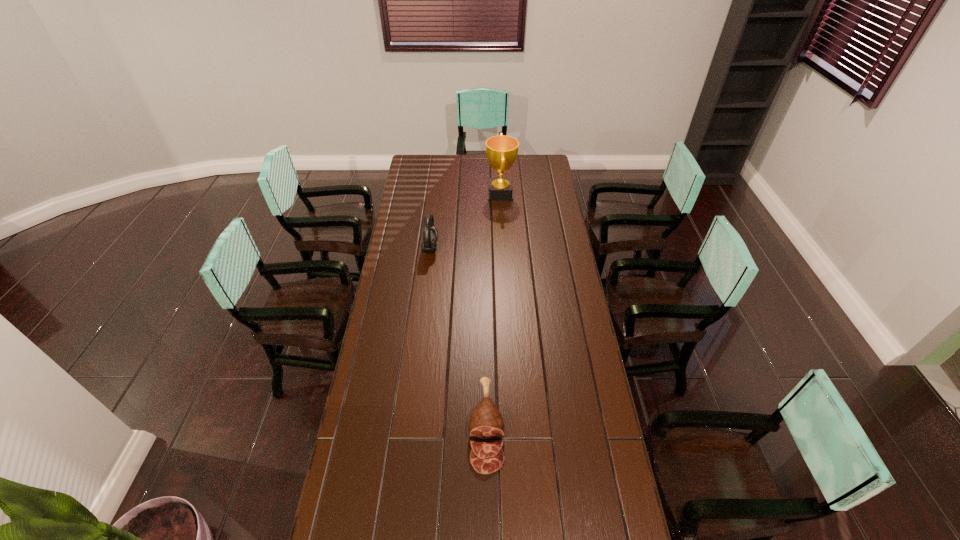
The height and width of the screenshot is (540, 960). I want to click on the closest object relative to the headset, so click(x=501, y=150).

Find the location of a particular element. The height and width of the screenshot is (540, 960). blank area in the image that satisfies the following two spatial constraints: 1. on the front-facing side of the farthest object; 2. at the sliced end of the shortest object is located at coordinates (514, 428).

Where is `free space that satisfies the following two spatial constraints: 1. on the front-facing side of the tallest object; 2. at the sliced end of the nearest object`? The width and height of the screenshot is (960, 540). free space that satisfies the following two spatial constraints: 1. on the front-facing side of the tallest object; 2. at the sliced end of the nearest object is located at coordinates (514, 428).

What are the coordinates of `free spot that satisfies the following two spatial constraints: 1. on the front-facing side of the award; 2. at the sliced end of the ham` in the screenshot? It's located at (514, 428).